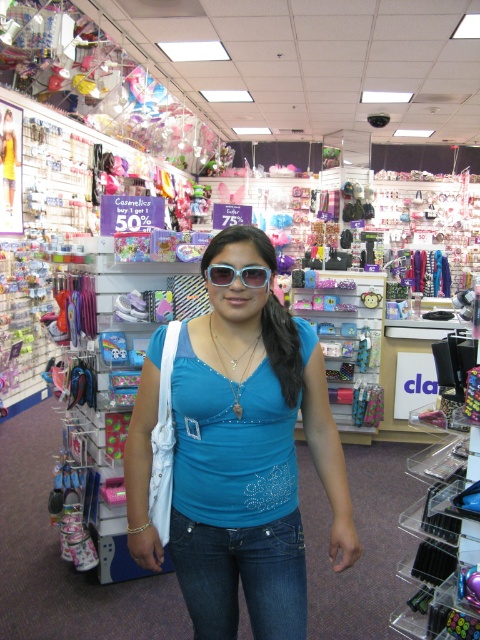
You are a customer in the store and want to locate the dark blue denim jeans at center. According to the store layout, where should you look to find them?

You should look at point [241,577] to find the dark blue denim jeans at center.

You are a customer in the store and want to pick up an item from the shelf. You notice two points on the shelf where items are placed. The first point is at coordinates point (265, 540) and the second is at point (252, 276). Which point is closer to you?

Point (265, 540) is further to the viewer than point (252, 276), so the second point at (252, 276) is closer to you.